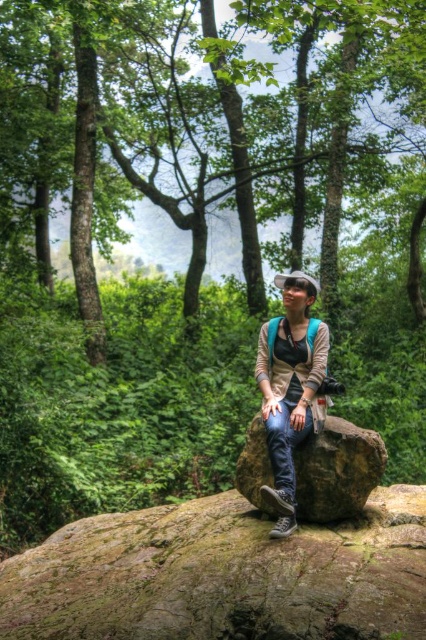
Is green leafy tree at center behind matte beige sweater at center?

Yes, it is behind matte beige sweater at center.

Who is positioned more to the left, green leafy tree at center or matte beige sweater at center?

From the viewer's perspective, green leafy tree at center appears more on the left side.

The image size is (426, 640). Describe the element at coordinates (209, 115) in the screenshot. I see `green leafy tree at center` at that location.

The image size is (426, 640). I want to click on green leafy tree at center, so click(x=209, y=115).

Does green leafy tree at center come in front of brown rough rock at center?

No, green leafy tree at center is further to the viewer.

Between point (26, 141) and point (264, 464), which one is positioned behind?

The point (26, 141) is behind.

Between point (284, 156) and point (371, 440), which one is positioned behind?

The point (284, 156) is more distant.

Locate an element on the screen. This screenshot has height=640, width=426. green leafy tree at center is located at coordinates (209, 115).

Is point (288, 476) positioned after point (342, 474)?

No, it is in front of (342, 474).

Is matte beige sweater at center wider than brown rough rock at center?

No, matte beige sweater at center is not wider than brown rough rock at center.

Which is in front, point (279, 460) or point (356, 442)?

Point (279, 460) is in front.

You are a GUI agent. You are given a task and a screenshot of the screen. Output one action in this format:
    pyautogui.click(x=<x>, y=<y>)
    Task: Click on the matte beige sweater at center
    The height and width of the screenshot is (640, 426).
    Given the screenshot: What is the action you would take?
    pyautogui.click(x=290, y=387)